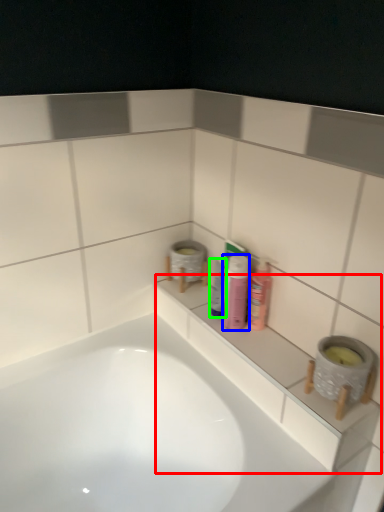
Question: Estimate the real-world distances between objects in this image. Which object is farther from ledge (highlighted by a red box), toiletry (highlighted by a blue box) or mouthwash (highlighted by a green box)?

Choices:
 (A) toiletry
 (B) mouthwash

Answer: (B)